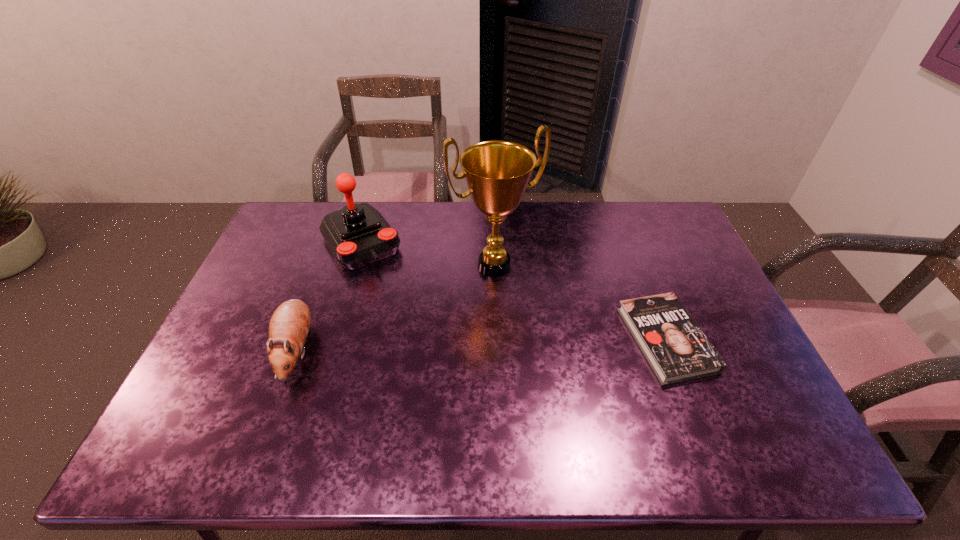
You are a GUI agent. You are given a task and a screenshot of the screen. Output one action in this format:
    pyautogui.click(x=<x>, y=<y>)
    Task: Click on the vacant space positioned 0.170m on the base of the joystick
    Image resolution: width=960 pixels, height=540 pixels.
    Given the screenshot: What is the action you would take?
    pyautogui.click(x=397, y=300)

Identify the location of vacant area situated 0.060m on the front view with handles of the award. 515,300.

Where is `free spot located on the front view with handles of the award`? The height and width of the screenshot is (540, 960). free spot located on the front view with handles of the award is located at coordinates (547, 367).

Identify the location of free location located 0.050m on the front view with handles of the award. The image size is (960, 540). (514, 298).

Where is `object at the far edge`? This screenshot has height=540, width=960. object at the far edge is located at coordinates (358, 235).

Locate an element on the screen. This screenshot has height=540, width=960. hamster at the near edge is located at coordinates (289, 325).

At what (x,y) coordinates should I click in order to perform the action: click on book that is at the near edge. Please return your answer as a coordinate pair (x, y). The image size is (960, 540). Looking at the image, I should click on (677, 350).

Find the location of a particular element. The height and width of the screenshot is (540, 960). object at the right edge is located at coordinates (677, 350).

The width and height of the screenshot is (960, 540). What are the coordinates of `object present at the near right corner` in the screenshot? It's located at (677, 350).

In the image, there is a desktop. Find the location of `blank space at the far edge`. blank space at the far edge is located at coordinates (425, 225).